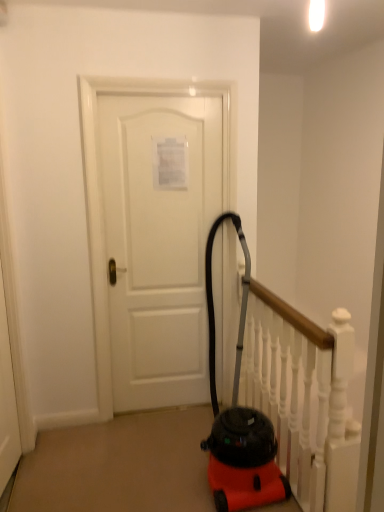
Locate an element on the screen. This screenshot has width=384, height=512. vacant area that is in front of white matte door at center is located at coordinates (139, 463).